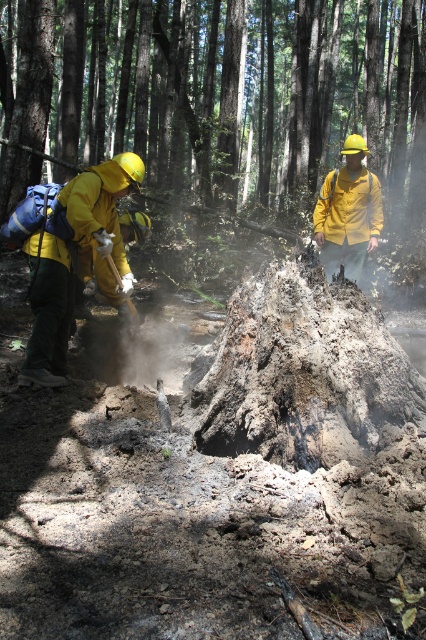
Question: Is charcoal ash stump at center above matte yellow jacket at left?

Choices:
 (A) no
 (B) yes

Answer: (B)

Question: Which of the following is the closest to the observer?

Choices:
 (A) (337, 198)
 (B) (60, 244)

Answer: (B)

Question: Estimate the real-world distances between objects in this image. Which object is farther from the matte yellow helmet at center?

Choices:
 (A) charcoal ash stump at center
 (B) matte yellow jacket at left

Answer: (A)

Question: Which of the following is the farthest from the observer?

Choices:
 (A) (324, 192)
 (B) (112, 106)

Answer: (B)

Question: Is the position of matte yellow jacket at left more distant than that of matte yellow helmet at center?

Choices:
 (A) yes
 (B) no

Answer: (B)

Question: Does matte yellow jacket at left appear on the left side of matte yellow helmet at center?

Choices:
 (A) no
 (B) yes

Answer: (B)